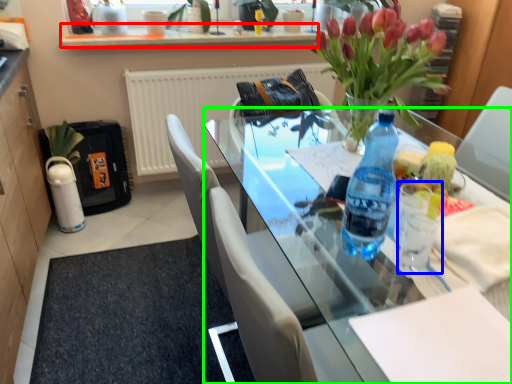
Question: Which object is positioned closest to window sill (highlighted by a red box)? Select from coffee cup (highlighted by a blue box) and desk (highlighted by a green box).

Choices:
 (A) coffee cup
 (B) desk

Answer: (B)